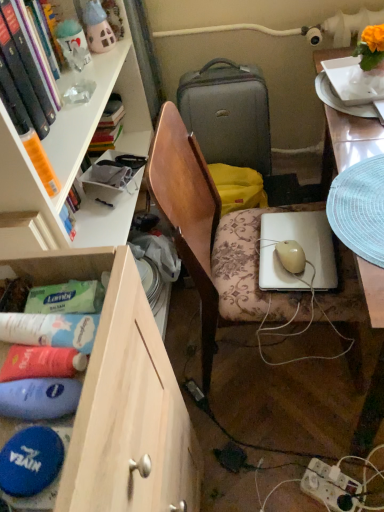
Question: Can you confirm if white glossy desk at right is positioned to the left of white plastic power outlet at lower right?

Choices:
 (A) yes
 (B) no

Answer: (B)

Question: Can you confirm if white glossy desk at right is smaller than white plastic power outlet at lower right?

Choices:
 (A) no
 (B) yes

Answer: (A)

Question: Is white glossy desk at right looking in the opposite direction of white plastic power outlet at lower right?

Choices:
 (A) no
 (B) yes

Answer: (A)

Question: Does white glossy desk at right have a larger size compared to white plastic power outlet at lower right?

Choices:
 (A) no
 (B) yes

Answer: (B)

Question: From a real-world perspective, is white glossy desk at right on top of white plastic power outlet at lower right?

Choices:
 (A) no
 (B) yes

Answer: (B)

Question: Relative to hardcover book at upper left, is white glossy desk at right in front or behind?

Choices:
 (A) front
 (B) behind

Answer: (A)

Question: Which is correct: white glossy desk at right is inside hardcover book at upper left, or outside of it?

Choices:
 (A) inside
 (B) outside

Answer: (B)

Question: Is white glossy desk at right taller or shorter than hardcover book at upper left?

Choices:
 (A) short
 (B) tall

Answer: (B)

Question: Is point (319, 62) positioned closer to the camera than point (26, 92)?

Choices:
 (A) closer
 (B) farther

Answer: (B)

Question: Is white glossy plate at upper right wider or thinner than wooden drawer at lower left?

Choices:
 (A) wide
 (B) thin

Answer: (B)

Question: In terms of size, does white glossy plate at upper right appear bigger or smaller than wooden drawer at lower left?

Choices:
 (A) big
 (B) small

Answer: (B)

Question: Is white glossy plate at upper right in front of or behind wooden drawer at lower left in the image?

Choices:
 (A) front
 (B) behind

Answer: (B)

Question: Visually, is white glossy plate at upper right positioned to the left or to the right of wooden drawer at lower left?

Choices:
 (A) right
 (B) left

Answer: (A)

Question: In the image, is wooden chair at center positioned in front of or behind wooden drawer at lower left?

Choices:
 (A) front
 (B) behind

Answer: (B)

Question: Is wooden chair at center inside or outside of wooden drawer at lower left?

Choices:
 (A) inside
 (B) outside

Answer: (B)